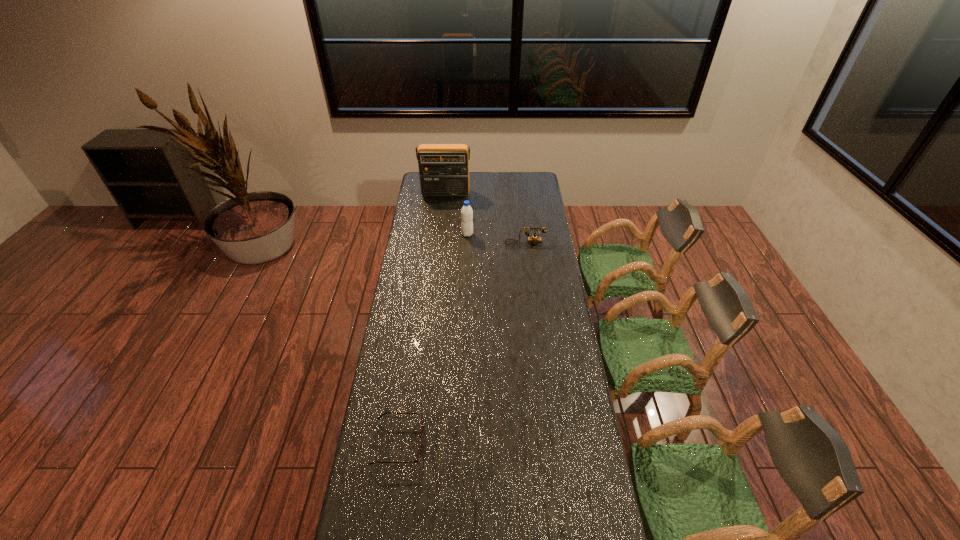
Locate an element on the screen. Image resolution: width=960 pixels, height=540 pixels. the farthest object is located at coordinates (443, 168).

This screenshot has width=960, height=540. I want to click on radio receiver, so click(443, 168).

Find the location of a particular element. The image size is (960, 540). the second tallest object is located at coordinates (466, 212).

Where is `water bottle`? This screenshot has width=960, height=540. water bottle is located at coordinates (466, 212).

Where is `the second shortest object`? the second shortest object is located at coordinates (534, 239).

The height and width of the screenshot is (540, 960). What are the coordinates of `the rightmost object` in the screenshot? It's located at (534, 239).

What are the coordinates of `spectacles` in the screenshot? It's located at (417, 460).

The image size is (960, 540). Find the location of `the shortest object`. the shortest object is located at coordinates (417, 460).

Where is `vacant space located 0.180m on the front-facing side of the radio receiver`? The image size is (960, 540). vacant space located 0.180m on the front-facing side of the radio receiver is located at coordinates pos(444,217).

What are the coordinates of `vacant space located on the front of the second farthest object` in the screenshot? It's located at (466, 289).